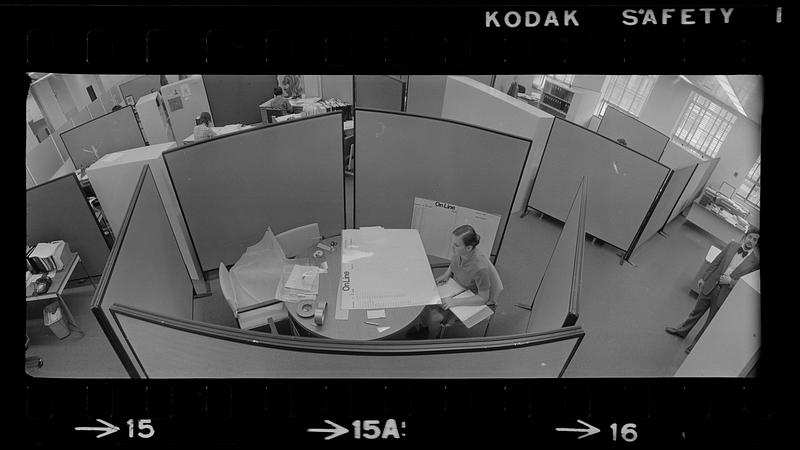
Locate an element on the screen. Image resolution: width=800 pixels, height=450 pixels. desk is located at coordinates (404, 257).